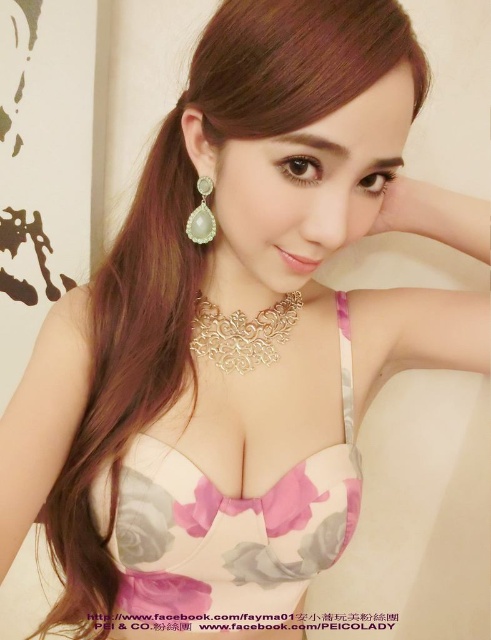
From the picture: You are a photographer adjusting your camera settings to capture a detailed closeup of the brown shiny hair at center. Considering the distance between the hair and the camera, what is the minimum focusing distance your camera lens should support to ensure the hair is in sharp focus?

The minimum focusing distance your camera lens should support is at least 20.27 inches to ensure the brown shiny hair at center is in sharp focus.